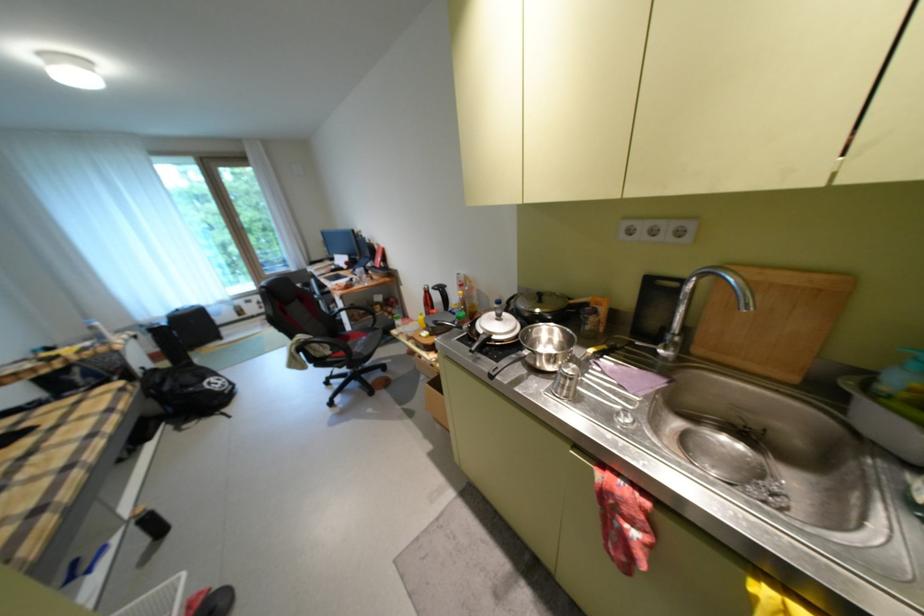
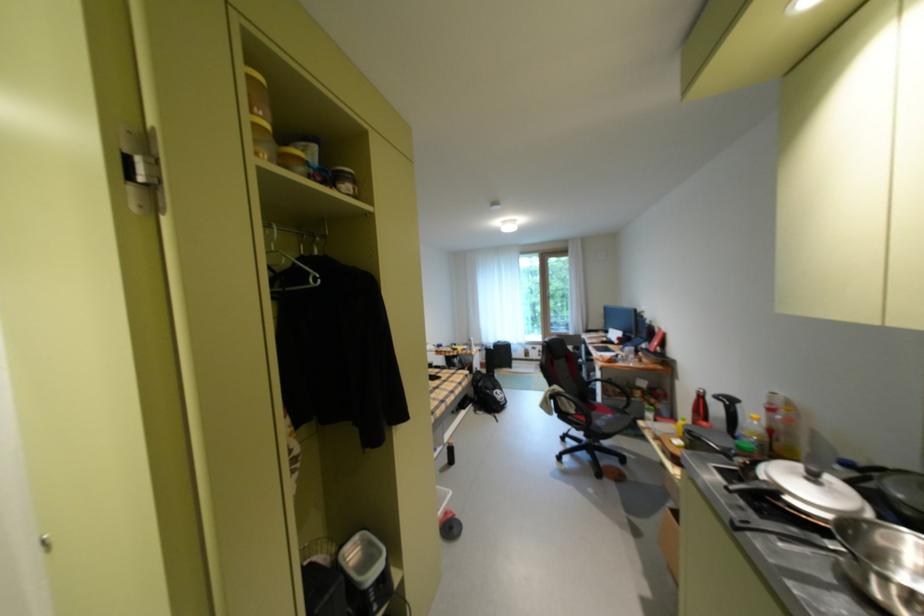
Find the pixel in the second image that matches point (381, 334) in the first image.

(629, 416)